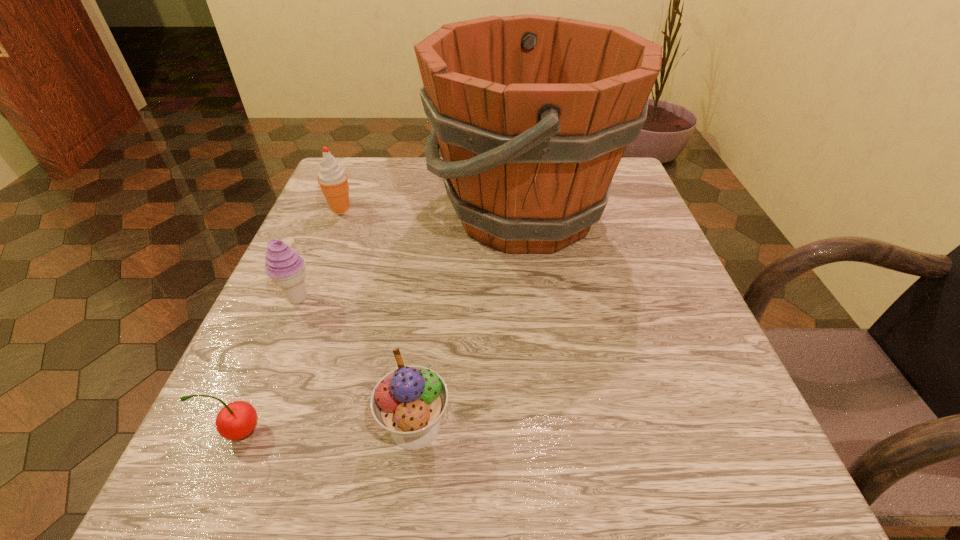
Where is `object that stands as the closest to the farthest icecream`? object that stands as the closest to the farthest icecream is located at coordinates (532, 114).

Find the location of `icecream that is the second closest to the second nearest icecream`. icecream that is the second closest to the second nearest icecream is located at coordinates (408, 402).

Where is `the second closest icecream relative to the rightmost icecream`? the second closest icecream relative to the rightmost icecream is located at coordinates (333, 180).

Identify the location of free spot that satisfies the following two spatial constraints: 1. on the front side of the second nearest icecream; 2. on the right side of the nearest icecream. (244, 427).

Find the location of a particular element. The height and width of the screenshot is (540, 960). vacant point that satisfies the following two spatial constraints: 1. on the back side of the rightmost icecream; 2. on the left side of the shortest object is located at coordinates (242, 427).

The width and height of the screenshot is (960, 540). Identify the location of vacant space that satisfies the following two spatial constraints: 1. on the back side of the nearest icecream; 2. on the right side of the shortest object. (242, 427).